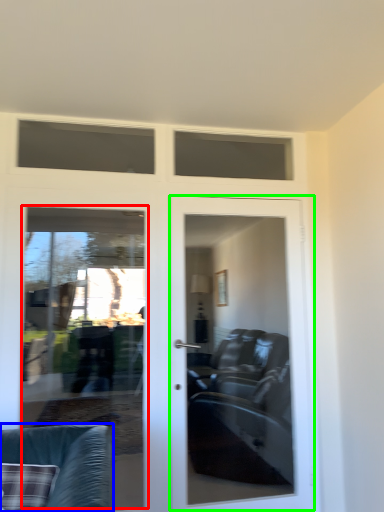
Question: Estimate the real-world distances between objects in this image. Which object is farther from screen door (highlighted by a red box), chair (highlighted by a blue box) or door (highlighted by a green box)?

Choices:
 (A) chair
 (B) door

Answer: (A)